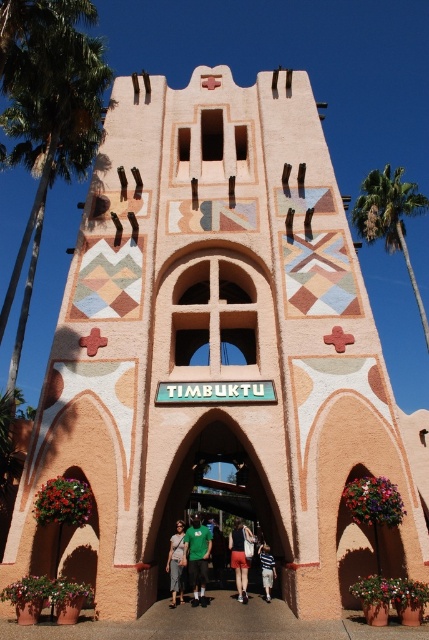
Question: In this image, where is pink stucco archway at center located relative to green fabric shirt at center?

Choices:
 (A) above
 (B) below

Answer: (A)

Question: Considering the relative positions of pink stucco archway at center and light blue denim shorts at center in the image provided, where is pink stucco archway at center located with respect to light blue denim shorts at center?

Choices:
 (A) left
 (B) right

Answer: (A)

Question: Does green leafy palm tree at left appear on the right side of green fabric shirt at center?

Choices:
 (A) no
 (B) yes

Answer: (A)

Question: Among these objects, which one is nearest to the camera?

Choices:
 (A) denim shorts at center
 (B) green leafy palm tree at upper right
 (C) green fabric shirt at center
 (D) pink stucco archway at center

Answer: (D)

Question: Which of these objects is positioned closest to the pink stucco archway at center?

Choices:
 (A) denim shorts at center
 (B) light blue denim shorts at center
 (C) green leafy palm tree at left

Answer: (A)

Question: Which point appears closest to the camera in this image?

Choices:
 (A) (398, 186)
 (B) (233, 536)

Answer: (B)